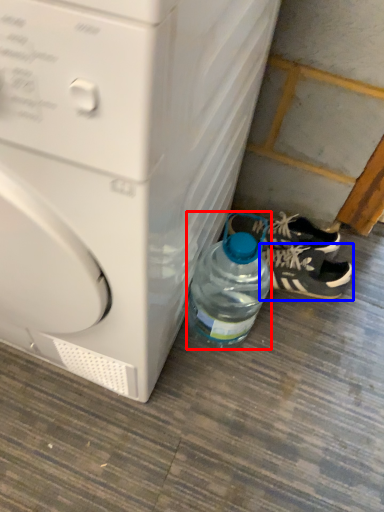
Question: Among these objects, which one is nearest to the camera, bottle (highlighted by a red box) or footwear (highlighted by a blue box)?

Choices:
 (A) bottle
 (B) footwear

Answer: (A)